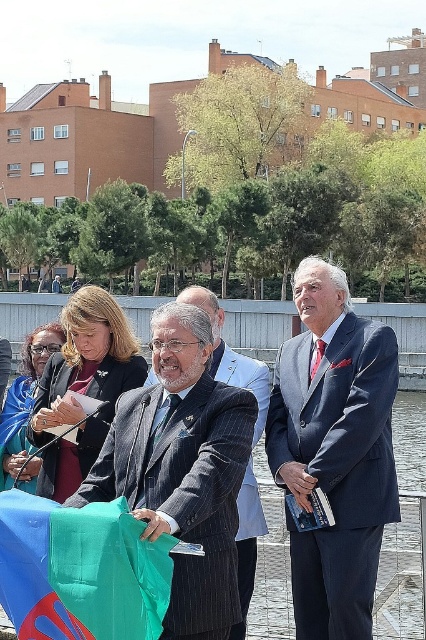
Looking at this image, you are a photographer standing at the edge of the river. You want to take a photo of the man at the podium and the flag he is holding. The camera you have can focus on objects up to 20 meters away. Will you be able to capture both the matte blue suit at center and the flag in the same photo clearly?

The matte blue suit at center and the flag are 19.47 meters apart. Since the camera can focus up to 20 meters, you can capture both clearly as 19.47 meters is within the camera range.

You are an event photographer at this riverside ceremony. You need to capture a photo of both the matte blue suit at center and the striped wool suit at center. Which one is positioned to the right of the other?

The matte blue suit at center is positioned to the right of the striped wool suit at center.